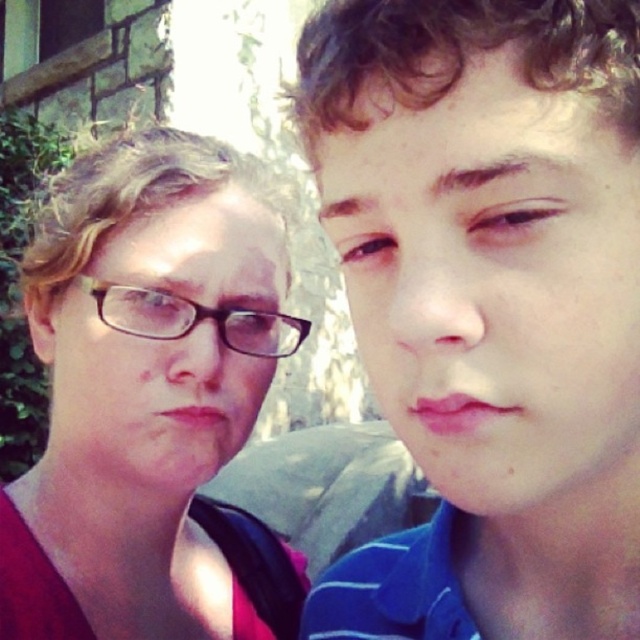
Question: Among these objects, which one is farthest from the camera?

Choices:
 (A) smooth skin face at upper right
 (B) matte black glasses at left
 (C) matte black glasses at upper left
 (D) black plastic glasses at upper left

Answer: (D)

Question: Which point is closer to the camera taking this photo?

Choices:
 (A) (536, 140)
 (B) (202, 262)

Answer: (A)

Question: Is smooth skin face at upper right bigger than black plastic glasses at upper left?

Choices:
 (A) no
 (B) yes

Answer: (B)

Question: Which object is closer to the camera taking this photo?

Choices:
 (A) matte black glasses at left
 (B) black plastic glasses at upper left
 (C) matte black glasses at upper left
 (D) smooth skin face at upper right

Answer: (D)

Question: Does smooth skin face at upper right appear on the right side of black plastic glasses at upper left?

Choices:
 (A) yes
 (B) no

Answer: (A)

Question: Is smooth skin face at upper right to the right of matte black glasses at left from the viewer's perspective?

Choices:
 (A) yes
 (B) no

Answer: (A)